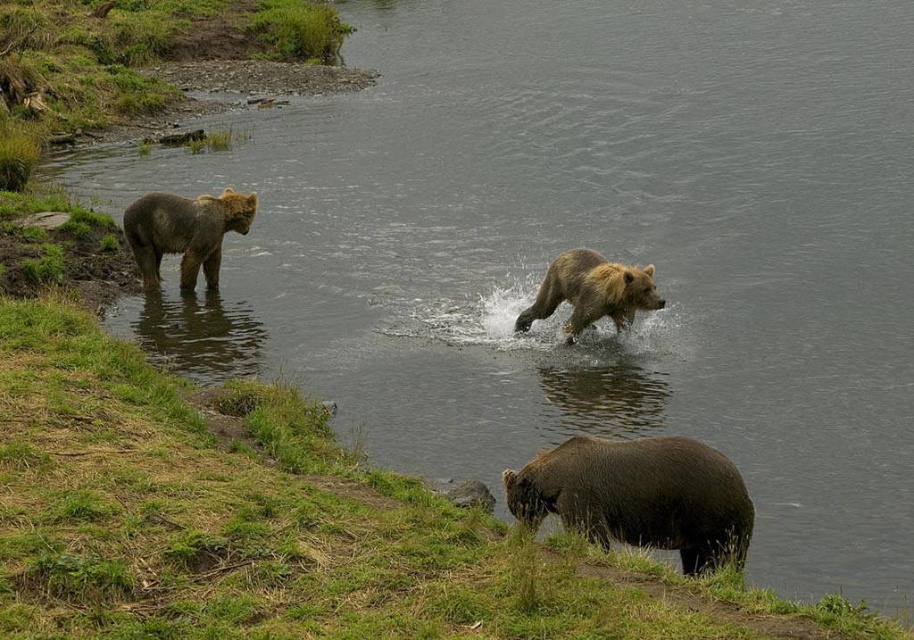
You are a wildlife photographer trying to capture a photo of the bears. You notice the brown fur bear at lower right and the brown fur bear at center. Which bear would appear wider in your camera frame?

The brown fur bear at lower right would appear wider in your camera frame because its width is larger than the brown fur bear at center.

You are a wildlife photographer positioned at the edge of the riverbank. You want to take a photo of both the brown fur bear at lower right and the brown fur bear at center. Which bear will appear larger in your photo?

The brown fur bear at lower right will appear larger in the photo because it is closer to the viewer than the brown fur bear at center.

Looking at this image, you are a hiker who wants to cross the river. You see the brown furry bear at left and the brown fur bear at center. Which bear is closer to the riverbank where you are standing?

The brown furry bear at left is closer to the riverbank where you are standing because it is positioned over the brown fur bear at center, indicating it is nearer to the observer.